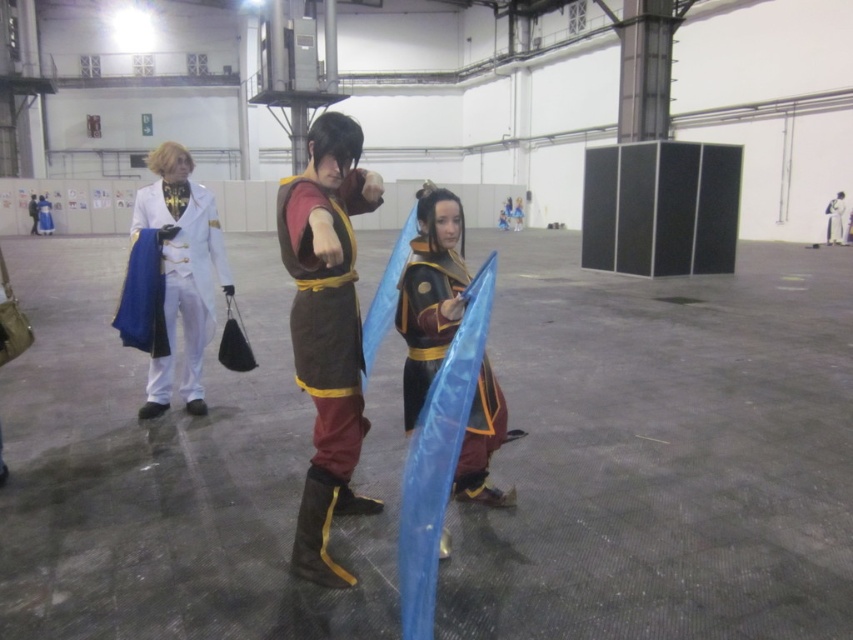
You are a photographer setting up a camera at the back of the hall. You need to ensure both the shiny gold armor at center and the white glossy coat at center are fully visible in your shot. Given their heights, which object might require you to adjust your camera angle to avoid being blocked?

The shiny gold armor at center has a lesser height compared to the white glossy coat at center, so it might be partially blocked by the taller white glossy coat at center. Adjusting the camera angle downward could help ensure both are fully visible.

You are standing in the industrial hall and see the brown leather tunic at center. If you want to reach it without moving closer, can you comfortably touch it with a 3.5 feet long stick?

The brown leather tunic at center is 6.73 feet away from the viewer. Since the stick is only 3.5 feet long, it is not long enough to reach the tunic.

You are a photographer trying to capture the shiny gold armor at center and the brown leather tunic at center in a single shot. Based on their positions, which one will appear higher in the photo?

The brown leather tunic at center is above the shiny gold armor at center, so it will appear higher in the photo.